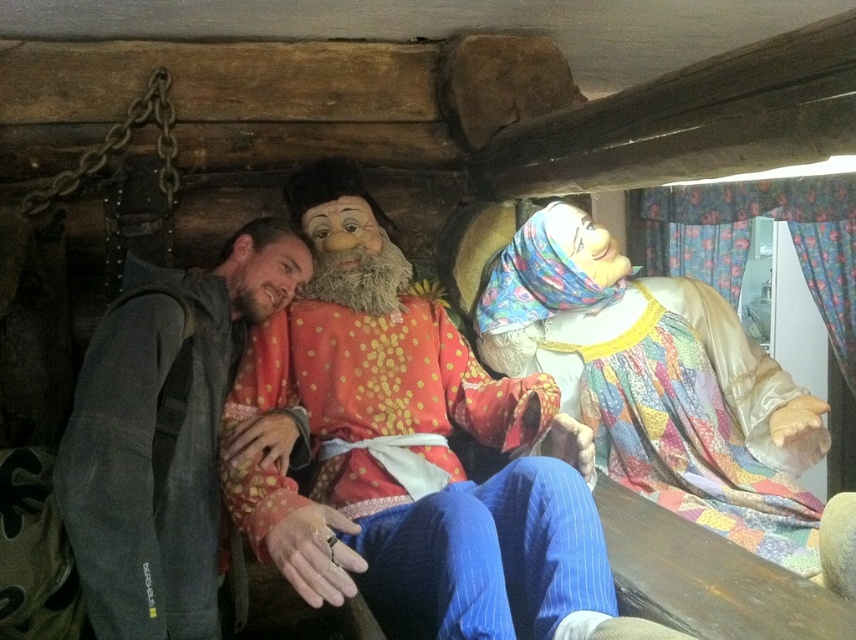
Question: Which of the following is the closest to the observer?

Choices:
 (A) multicolored fabric dress at upper right
 (B) red velvet robe at center
 (C) gray fabric jacket at left

Answer: (B)

Question: Can you confirm if red velvet robe at center is bigger than multicolored fabric dress at upper right?

Choices:
 (A) yes
 (B) no

Answer: (B)

Question: Does multicolored fabric dress at upper right appear over gray fabric jacket at left?

Choices:
 (A) yes
 (B) no

Answer: (A)

Question: Does multicolored fabric dress at upper right appear under gray fabric jacket at left?

Choices:
 (A) no
 (B) yes

Answer: (A)

Question: Which is nearer to the red velvet robe at center?

Choices:
 (A) gray fabric jacket at left
 (B) multicolored fabric dress at upper right

Answer: (A)

Question: Which object appears farthest from the camera in this image?

Choices:
 (A) multicolored fabric dress at upper right
 (B) red velvet robe at center

Answer: (A)